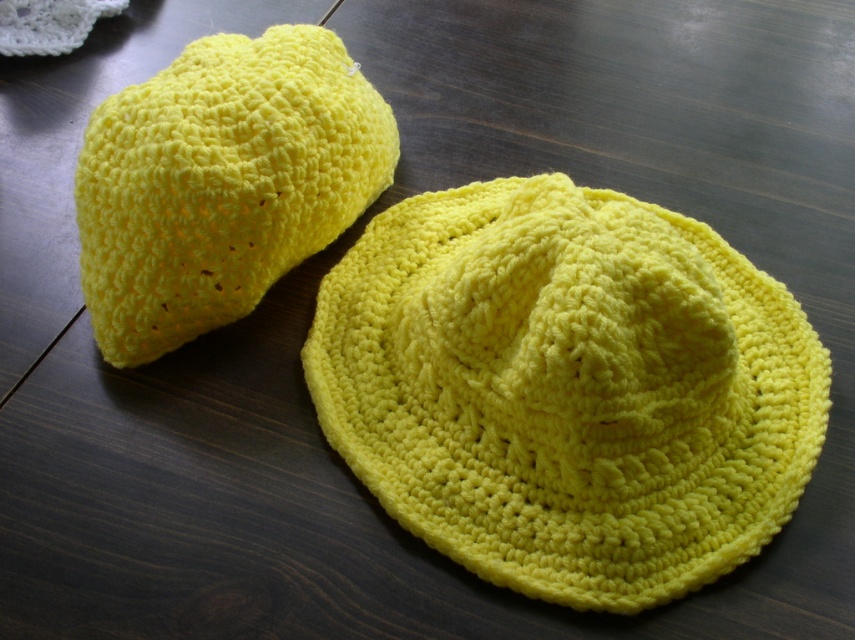
You are standing in front of a dark wooden table with two yellow crocheted items. You need to place a new item exactly at the center of the table. However, there is already a yellow crochet hat at center. Where should you place the new item to avoid overlapping with the existing one?

The yellow crochet hat at center is already located at the center of the table, so placing another item there would cause overlap. You should place the new item elsewhere on the table to avoid overlapping with the yellow crochet hat at center.

You are standing 5 feet away from the dark wooden surface where the two crocheted items are placed. There is a specific point at coordinates point (647, 348) on that surface. Can you reach this point without moving closer than 4 feet to the surface?

The distance of point (647, 348) from the viewer is 4.09 feet, so yes, you can reach it without moving closer than 4 feet since 4.09 feet is slightly further away than 4 feet.

You are organizing a craft fair and need to display two yellow crochet hats. The yellow crochet hat at center and the yellow crochet hat at upper left are placed on a dark wooden table. Which hat is positioned lower on the table?

The yellow crochet hat at center is positioned lower on the table than the yellow crochet hat at upper left.